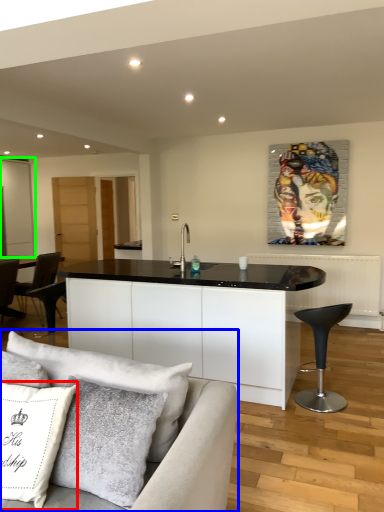
Question: Based on their relative distances, which object is farther from pillow (highlighted by a red box)? Choose from studio couch (highlighted by a blue box) and glass door (highlighted by a green box).

Choices:
 (A) studio couch
 (B) glass door

Answer: (B)